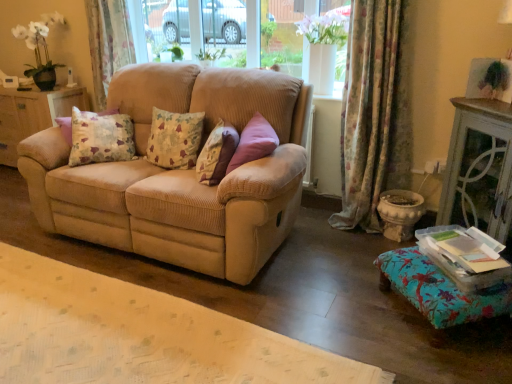
Describe the element at coordinates (441, 290) in the screenshot. I see `floral fabric ottoman at lower right` at that location.

What do you see at coordinates (33, 114) in the screenshot? I see `matte wood dresser at left` at bounding box center [33, 114].

Where is `clear glass window at center`? Image resolution: width=512 pixels, height=384 pixels. clear glass window at center is located at coordinates (290, 31).

Describe the element at coordinates (374, 112) in the screenshot. I see `floral fabric curtain at right, the second curtain when ordered from left to right` at that location.

Measure the distance between floral fabric curtain at right, the second curtain when ordered from left to right, and camera.

A distance of 7.61 feet exists between floral fabric curtain at right, the second curtain when ordered from left to right, and camera.

At what (x,y) coordinates should I click in order to perform the action: click on beige corduroy couch at center. Please return your answer as a coordinate pair (x, y). The width and height of the screenshot is (512, 384). Looking at the image, I should click on (180, 174).

From the picture: In the image, is floral fabric ottoman at lower right positioned in front of or behind matte wood dresser at left?

Clearly, floral fabric ottoman at lower right is in front of matte wood dresser at left.

Based on the photo, considering the relative sizes of floral fabric ottoman at lower right and matte wood dresser at left in the image provided, is floral fabric ottoman at lower right wider than matte wood dresser at left?

Correct, the width of floral fabric ottoman at lower right exceeds that of matte wood dresser at left.

Measure the distance between floral fabric ottoman at lower right and matte wood dresser at left.

floral fabric ottoman at lower right is 3.04 meters away from matte wood dresser at left.

Can you confirm if floral fabric ottoman at lower right is smaller than matte wood dresser at left?

Correct, floral fabric ottoman at lower right occupies less space than matte wood dresser at left.

Find the location of a particular element. This screenshot has height=384, width=512. curtain that is the 2nd object above the beige corduroy couch at center (from a real-world perspective) is located at coordinates (108, 43).

Considering the relative positions of floral fabric curtain at upper left, positioned as the 1th curtain in left-to-right order, and beige corduroy couch at center in the image provided, is floral fabric curtain at upper left, positioned as the 1th curtain in left-to-right order, to the right of beige corduroy couch at center from the viewer's perspective?

Incorrect, floral fabric curtain at upper left, positioned as the 1th curtain in left-to-right order, is not on the right side of beige corduroy couch at center.

How far apart are floral fabric curtain at upper left, positioned as the 1th curtain in left-to-right order, and beige corduroy couch at center?

They are 3.55 feet apart.

Which of these two, floral fabric curtain at upper left, arranged as the 2th curtain when viewed from the front, or beige corduroy couch at center, stands taller?

With more height is beige corduroy couch at center.

From a real-world perspective, is floral fabric curtain at right, the second curtain when ordered from left to right, over floral fabric cushion at center, which ranks as the first pillow in left-to-right order?

Yes.

Would you consider floral fabric curtain at right, which is the 2th curtain from back to front, to be distant from floral fabric cushion at center, which ranks as the first pillow in left-to-right order?

Yes, floral fabric curtain at right, which is the 2th curtain from back to front, and floral fabric cushion at center, which ranks as the first pillow in left-to-right order, are quite far apart.

Is floral fabric curtain at right, the second curtain when ordered from left to right, oriented towards floral fabric cushion at center, placed as the 2th pillow when sorted from right to left?

No, floral fabric curtain at right, the second curtain when ordered from left to right, is not facing towards floral fabric cushion at center, placed as the 2th pillow when sorted from right to left.

Based on the photo, from the image's perspective, is beige corduroy couch at center over matte wood dresser at left?

Incorrect, from the image's perspective, beige corduroy couch at center is lower than matte wood dresser at left.

Is matte wood dresser at left at the back of beige corduroy couch at center?

No, beige corduroy couch at center is not facing away from matte wood dresser at left.

Measure the distance from beige corduroy couch at center to matte wood dresser at left.

1.42 meters.

Between beige corduroy couch at center and matte wood dresser at left, which one is positioned behind?

matte wood dresser at left is further from the camera.

Between fluffy beige pillow at center, marked as the 2th pillow in a left-to-right arrangement, and matte wood dresser at left, which one has smaller width?

With smaller width is fluffy beige pillow at center, marked as the 2th pillow in a left-to-right arrangement.

From a real-world perspective, who is located lower, fluffy beige pillow at center, marked as the 2th pillow in a left-to-right arrangement, or matte wood dresser at left?

matte wood dresser at left.

Can you tell me how much fluffy beige pillow at center, the 1th pillow when ordered from right to left, and matte wood dresser at left differ in facing direction?

The facing directions of fluffy beige pillow at center, the 1th pillow when ordered from right to left, and matte wood dresser at left are 64.5 degrees apart.

From the picture: Between floral fabric curtain at right, the second curtain when ordered from left to right, and floral fabric ottoman at lower right, which one has larger width?

Wider between the two is floral fabric ottoman at lower right.

Are floral fabric curtain at right, acting as the 1th curtain starting from the front, and floral fabric ottoman at lower right making contact?

No, floral fabric curtain at right, acting as the 1th curtain starting from the front, is not with floral fabric ottoman at lower right.

Is point (394, 16) closer to camera compared to point (421, 272)?

No, (394, 16) is behind (421, 272).

How much distance is there between floral fabric curtain at right, which is the 2th curtain from back to front, and floral fabric ottoman at lower right?

34.50 inches.

Is point (79, 105) closer to viewer compared to point (376, 148)?

That is False.

Which object is positioned more to the left, matte wood dresser at left or floral fabric curtain at right, which appears as the 1th curtain when viewed from the right?

Positioned to the left is matte wood dresser at left.

At what (x,y) coordinates should I click in order to perform the action: click on dresser lying above the floral fabric curtain at right, which is the 2th curtain from back to front (from the image's perspective). Please return your answer as a coordinate pair (x, y). Image resolution: width=512 pixels, height=384 pixels. Looking at the image, I should click on (33, 114).

How many degrees apart are the facing directions of matte wood dresser at left and floral fabric curtain at right, which is the 2th curtain from back to front?

They differ by 0.000258 degrees in their facing directions.

Identify the location of swivel chair on the right of matte wood dresser at left. click(441, 290).

This screenshot has width=512, height=384. What are the coordinates of `curtain that is on the left side of beige corduroy couch at center` in the screenshot? It's located at (108, 43).

Considering their positions, is clear glass window at center positioned further to floral fabric cushion at center, placed as the 2th pillow when sorted from right to left, than floral fabric curtain at upper left, positioned as the 1th curtain in left-to-right order?

Among the two, clear glass window at center is located further to floral fabric cushion at center, placed as the 2th pillow when sorted from right to left.

Which object lies further to the anchor point floral fabric ottoman at lower right, floral fabric cushion at center, which ranks as the first pillow in left-to-right order, or fluffy beige pillow at center, the 1th pillow when ordered from right to left?

floral fabric cushion at center, which ranks as the first pillow in left-to-right order, is positioned further to the anchor floral fabric ottoman at lower right.

Looking at the image, which one is located closer to beige corduroy couch at center, fluffy beige pillow at center, the 1th pillow when ordered from right to left, or floral fabric curtain at right, which appears as the 1th curtain when viewed from the right?

fluffy beige pillow at center, the 1th pillow when ordered from right to left, is closer to beige corduroy couch at center.

Consider the image. Estimate the real-world distances between objects in this image. Which object is closer to floral fabric curtain at upper left, the second curtain when ordered from right to left, beige corduroy couch at center or matte wood dresser at left?

matte wood dresser at left is closer to floral fabric curtain at upper left, the second curtain when ordered from right to left.

Which object lies nearer to the anchor point matte wood dresser at left, floral fabric curtain at right, which appears as the 1th curtain when viewed from the right, or floral fabric curtain at upper left, the first curtain viewed from the back?

The object closer to matte wood dresser at left is floral fabric curtain at upper left, the first curtain viewed from the back.

Looking at this image, when comparing their distances from clear glass window at center, does beige corduroy couch at center or floral fabric cushion at center, placed as the 2th pillow when sorted from right to left, seem closer?

beige corduroy couch at center is closer to clear glass window at center.

Based on the photo, based on their spatial positions, is floral fabric curtain at upper left, the second curtain when ordered from right to left, or floral fabric curtain at right, which appears as the 1th curtain when viewed from the right, further from clear glass window at center?

floral fabric curtain at right, which appears as the 1th curtain when viewed from the right, is further to clear glass window at center.

Considering their positions, is floral fabric curtain at upper left, the second curtain when ordered from right to left, positioned closer to floral fabric cushion at center, which ranks as the first pillow in left-to-right order, than matte wood dresser at left?

floral fabric curtain at upper left, the second curtain when ordered from right to left, is closer to floral fabric cushion at center, which ranks as the first pillow in left-to-right order.

Where is `pillow between floral fabric cushion at center, which ranks as the first pillow in left-to-right order, and floral fabric curtain at right, the second curtain when ordered from left to right, in the horizontal direction`? pillow between floral fabric cushion at center, which ranks as the first pillow in left-to-right order, and floral fabric curtain at right, the second curtain when ordered from left to right, in the horizontal direction is located at coordinates (216, 154).

The image size is (512, 384). I want to click on studio couch located between matte wood dresser at left and floral fabric ottoman at lower right in the left-right direction, so click(180, 174).

The height and width of the screenshot is (384, 512). I want to click on curtain situated between fluffy beige pillow at center, marked as the 2th pillow in a left-to-right arrangement, and floral fabric ottoman at lower right from left to right, so click(x=374, y=112).

In order to click on curtain situated between floral fabric curtain at upper left, positioned as the 1th curtain in left-to-right order, and floral fabric ottoman at lower right from left to right in this screenshot , I will do `click(374, 112)`.